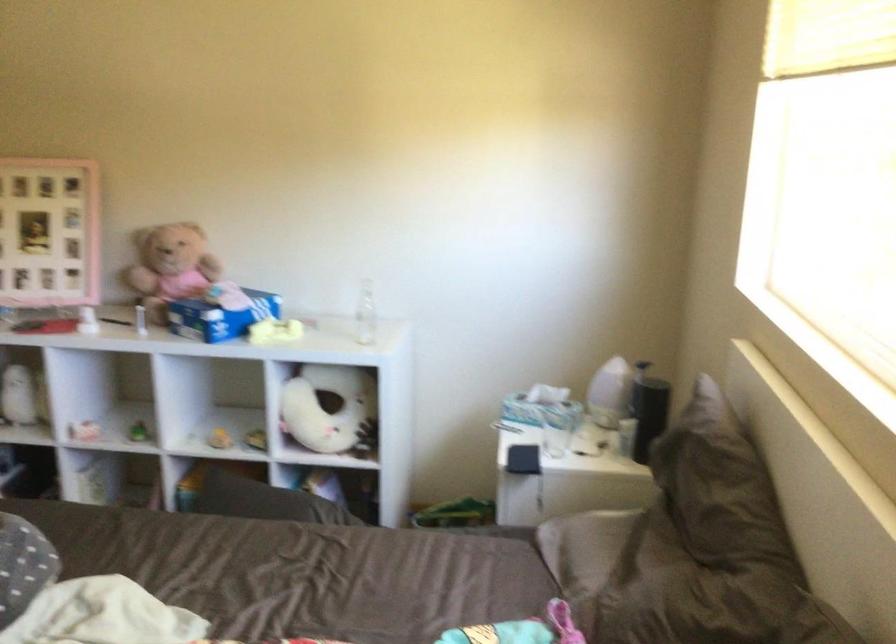
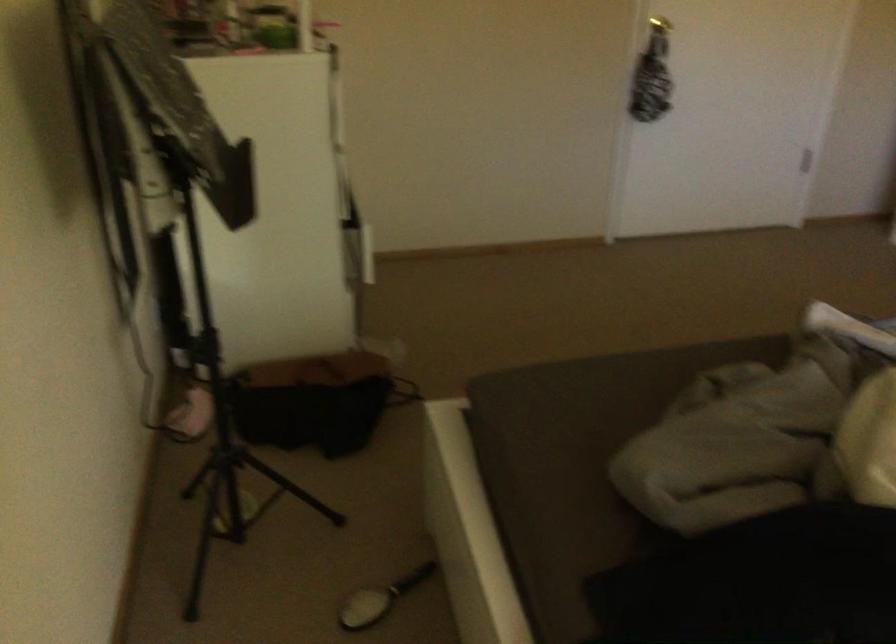
First-person continuous shooting, in which direction is the camera rotating?

The camera's rotation is toward left-down.